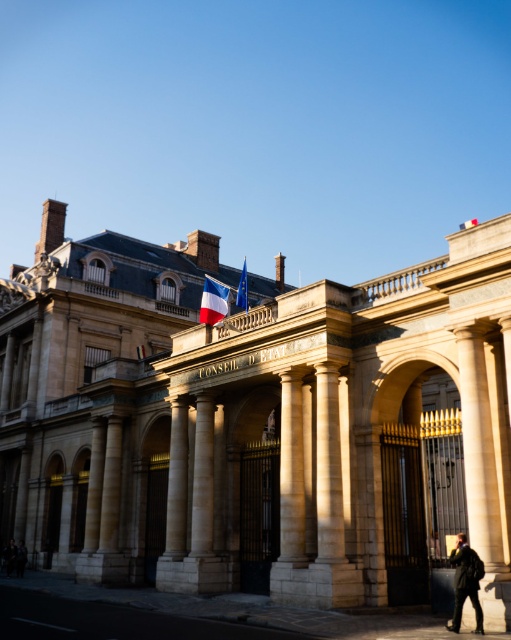
Who is more distant from viewer, [220,304] or [247,301]?

Positioned behind is point [247,301].

Is point (226, 304) positioned before point (242, 289)?

That is True.

Is point (205, 289) in front of point (242, 273)?

Yes, point (205, 289) is closer to viewer.

Where is `blue-white-red fabric flag at center`? The width and height of the screenshot is (511, 640). blue-white-red fabric flag at center is located at coordinates (214, 300).

Based on the photo, which is more to the left, smooth stone pillar at center or blue fabric flag at center?

Positioned to the left is blue fabric flag at center.

From the picture: Which is below, smooth stone pillar at center or blue fabric flag at center?

smooth stone pillar at center

Where is `smooth stone pillar at center`? The width and height of the screenshot is (511, 640). smooth stone pillar at center is located at coordinates (202, 477).

Image resolution: width=511 pixels, height=640 pixels. In order to click on stone building at center in this screenshot , I will do `click(259, 420)`.

Is stone building at center to the left of blue fabric flag at center from the viewer's perspective?

Correct, you'll find stone building at center to the left of blue fabric flag at center.

Does point (367, 396) lie in front of point (238, 298)?

Yes, it is in front of point (238, 298).

Locate an element on the screen. stone building at center is located at coordinates (259, 420).